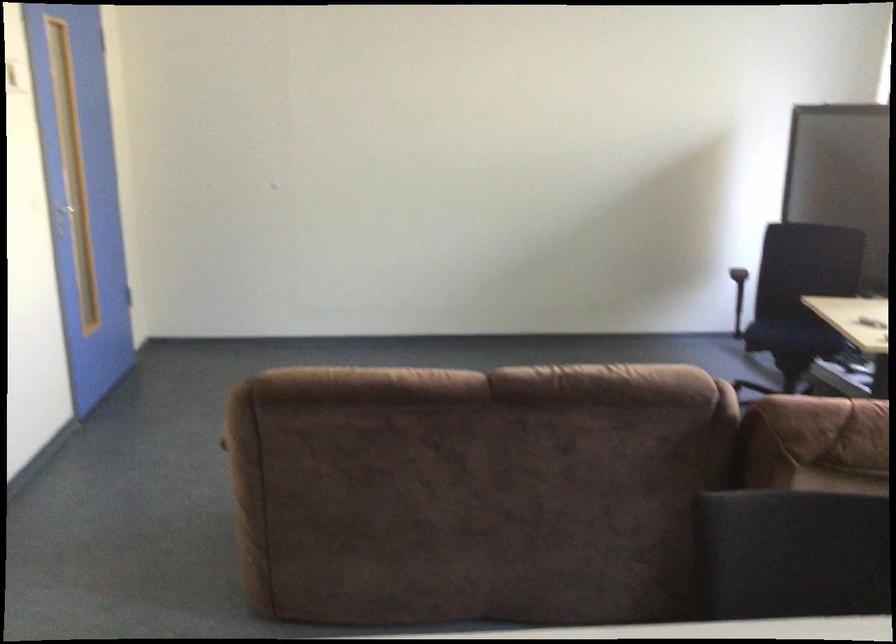
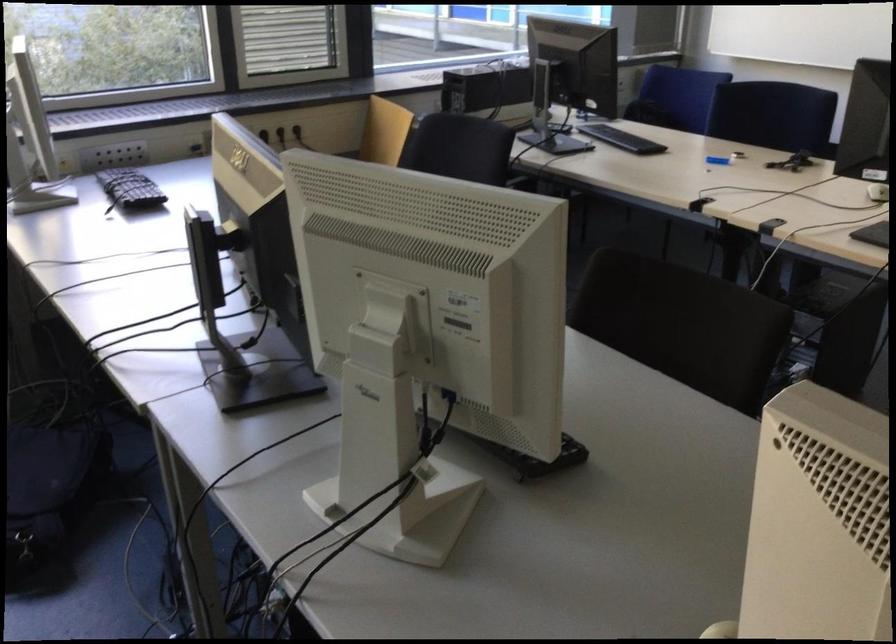
Consider the image. The images are taken continuously from a first-person perspective. In which direction is your viewpoint rotating?

The rotation direction of the camera is right-down.